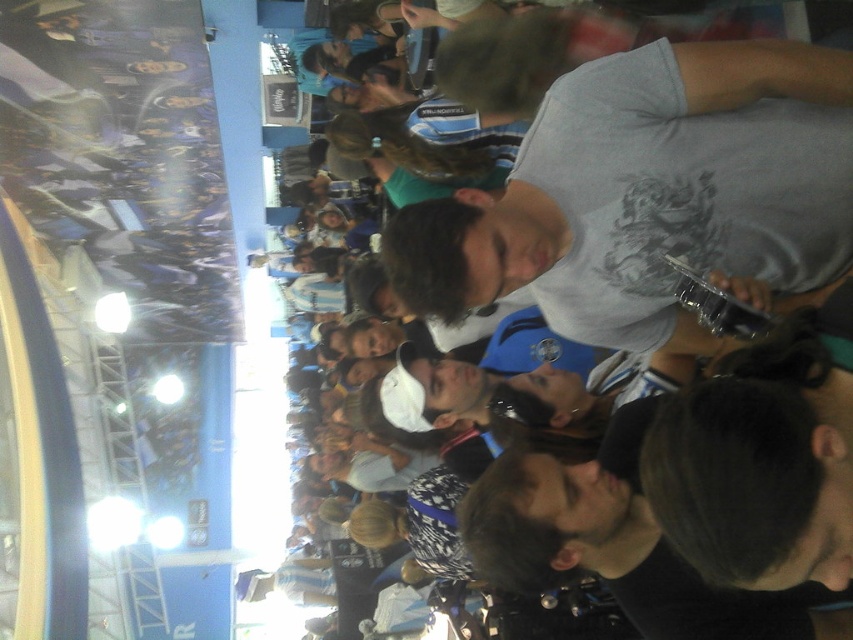
Describe the element at coordinates (651, 193) in the screenshot. The image size is (853, 640). I see `gray matte t-shirt at center` at that location.

Does point (795, 102) come behind point (689, 595)?

No, (795, 102) is in front of (689, 595).

Who is more distant from viewer, (775, 93) or (805, 592)?

Point (775, 93)

Where is `gray matte t-shirt at center`? The height and width of the screenshot is (640, 853). gray matte t-shirt at center is located at coordinates click(x=651, y=193).

Can you confirm if gray matte t-shirt at center is positioned to the right of white cotton shirt at center?

In fact, gray matte t-shirt at center is to the left of white cotton shirt at center.

This screenshot has width=853, height=640. What do you see at coordinates (651, 193) in the screenshot? I see `gray matte t-shirt at center` at bounding box center [651, 193].

Identify the location of gray matte t-shirt at center. The height and width of the screenshot is (640, 853). (651, 193).

Does white cotton shirt at center have a lesser width compared to black matte shirt at center?

No, white cotton shirt at center is not thinner than black matte shirt at center.

Does white cotton shirt at center have a larger size compared to black matte shirt at center?

Correct, white cotton shirt at center is larger in size than black matte shirt at center.

Between point (691, 330) and point (531, 492), which one is positioned behind?

Positioned behind is point (691, 330).

I want to click on white cotton shirt at center, so click(x=651, y=195).